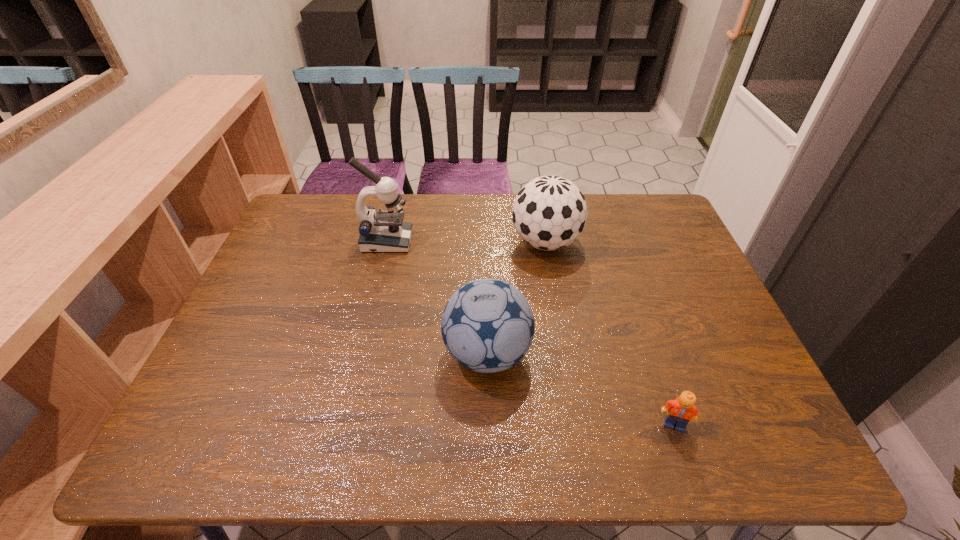
You are a GUI agent. You are given a task and a screenshot of the screen. Output one action in this format:
    pyautogui.click(x=<x>, y=<y>)
    Task: Click on the free region located on the side with brand of the second nearest object
    This screenshot has width=960, height=540.
    Given the screenshot: What is the action you would take?
    pyautogui.click(x=319, y=354)

The width and height of the screenshot is (960, 540). I want to click on blank space located on the front-facing side of the rightmost object, so click(x=686, y=462).

Where is `microscope that is at the far edge`? Image resolution: width=960 pixels, height=540 pixels. microscope that is at the far edge is located at coordinates (384, 231).

In order to click on soccer ball present at the far edge in this screenshot , I will do `click(550, 212)`.

Where is `object at the near edge`? The width and height of the screenshot is (960, 540). object at the near edge is located at coordinates 680,411.

The width and height of the screenshot is (960, 540). In the image, there is a desktop. What are the coordinates of `blank space at the far edge` in the screenshot? It's located at (461, 205).

Image resolution: width=960 pixels, height=540 pixels. In order to click on vacant area at the near edge of the desktop in this screenshot , I will do `click(541, 454)`.

In the image, there is a desktop. Find the location of `blank space at the left edge`. blank space at the left edge is located at coordinates (205, 375).

The height and width of the screenshot is (540, 960). In the image, there is a desktop. In order to click on vacant area at the right edge in this screenshot , I will do `click(746, 419)`.

In order to click on free point at the far left corner in this screenshot , I will do `click(309, 194)`.